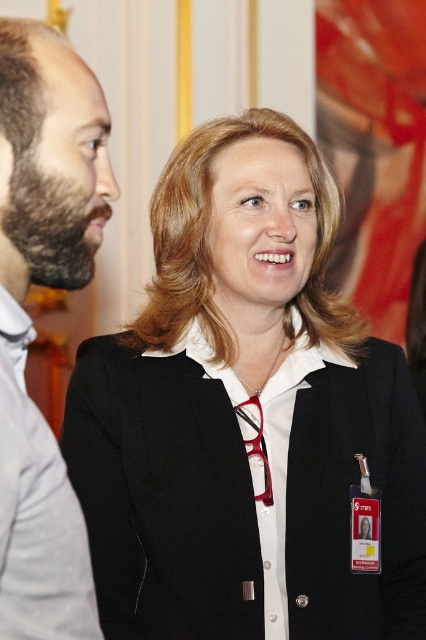
Can you confirm if bearded man at left is positioned to the right of white cotton dress shirt at left?

Indeed, bearded man at left is positioned on the right side of white cotton dress shirt at left.

Does point (17, 196) come farther from viewer compared to point (31, 545)?

Yes, it is.

Which is behind, point (46, 113) or point (97, 632)?

Point (97, 632)

At what (x,y) coordinates should I click in order to perform the action: click on bearded man at left. Please return your answer as a coordinate pair (x, y). The image size is (426, 640). Looking at the image, I should click on (49, 163).

Which is in front, point (181, 520) or point (31, 97)?

Point (31, 97)

Is black matte blazer at center below bearded man at left?

Indeed, black matte blazer at center is positioned under bearded man at left.

Is point (296, 632) positioned behind point (49, 76)?

Yes, point (296, 632) is behind point (49, 76).

The height and width of the screenshot is (640, 426). What are the coordinates of `black matte blazer at center` in the screenshot? It's located at (244, 493).

Does black matte blazer at center appear over white cotton dress shirt at left?

Actually, black matte blazer at center is below white cotton dress shirt at left.

Is black matte blazer at center positioned in front of white cotton dress shirt at left?

No.

Which is in front, point (408, 572) or point (40, 486)?

Point (40, 486) is in front.

Where is `black matte blazer at center`? This screenshot has height=640, width=426. black matte blazer at center is located at coordinates (244, 493).